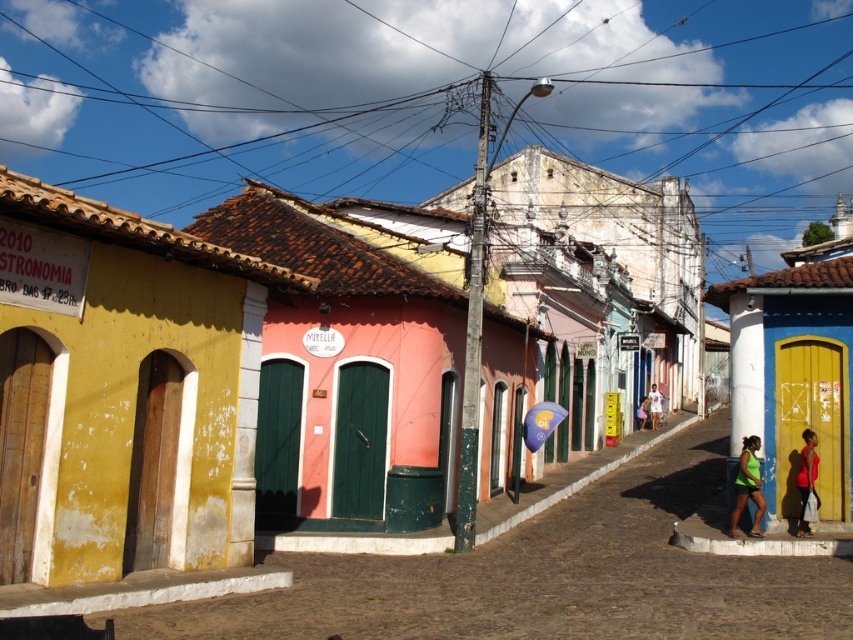
Locate an element on the screen. The image size is (853, 640). green matte tank top at lower right is located at coordinates (747, 486).

Can you confirm if green matte tank top at lower right is taller than red fabric shirt at lower right?

Incorrect, green matte tank top at lower right's height is not larger of red fabric shirt at lower right's.

Describe the element at coordinates (747, 486) in the screenshot. I see `green matte tank top at lower right` at that location.

Find the location of a particular element. Image resolution: width=853 pixels, height=640 pixels. green matte tank top at lower right is located at coordinates (747, 486).

Is green matte tank top at lower right to the left of white matte shirt at center from the viewer's perspective?

A: Correct, you'll find green matte tank top at lower right to the left of white matte shirt at center.

Based on the photo, is green matte tank top at lower right shorter than white matte shirt at center?

Yes, green matte tank top at lower right is shorter than white matte shirt at center.

Is point (752, 444) behind point (654, 401)?

No, it is in front of (654, 401).

Locate an element on the screen. The height and width of the screenshot is (640, 853). green matte tank top at lower right is located at coordinates (747, 486).

Which is behind, point (648, 404) or point (643, 400)?

Point (643, 400)

Is point (654, 388) behind point (646, 410)?

That is True.

Where is `white matte shirt at center`? The height and width of the screenshot is (640, 853). white matte shirt at center is located at coordinates (653, 406).